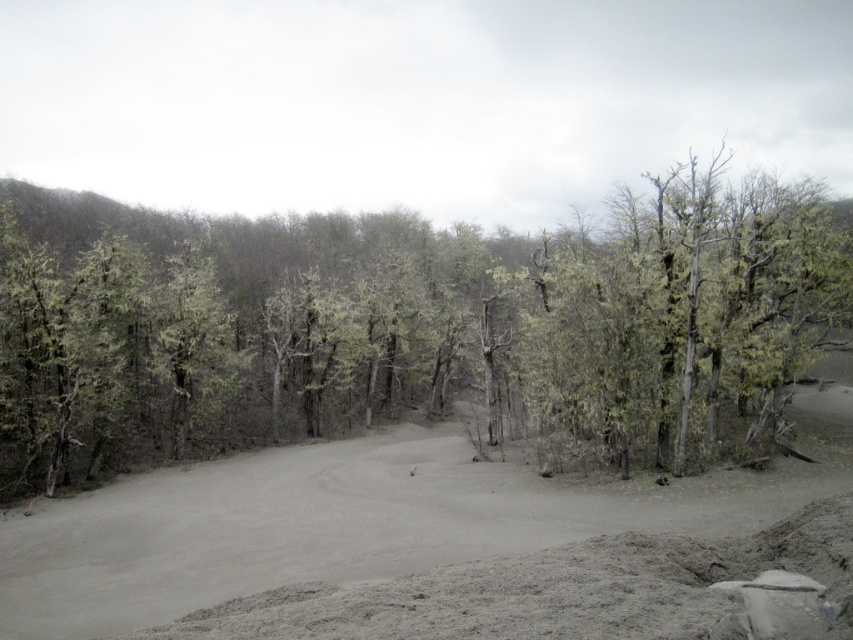
Is the position of green mossy tree at center less distant than that of gray sandy dirt track at center?

That is False.

Find the location of a particular element. This screenshot has width=853, height=640. green mossy tree at center is located at coordinates (410, 326).

Locate an element on the screen. green mossy tree at center is located at coordinates (410, 326).

Who is taller, gray sandy dirt track at center or gray sandy road at center?

With more height is gray sandy dirt track at center.

Is gray sandy dirt track at center further to camera compared to gray sandy road at center?

Yes.

Between point (198, 604) and point (563, 566), which one is positioned in front?

Point (563, 566) is more forward.

Identify the location of gray sandy dirt track at center. This screenshot has height=640, width=853. (357, 520).

Can you confirm if green mossy tree at center is wider than gray sandy road at center?

Yes.

Between green mossy tree at center and gray sandy road at center, which one is positioned lower?

gray sandy road at center is below.

What do you see at coordinates (410, 326) in the screenshot?
I see `green mossy tree at center` at bounding box center [410, 326].

You are a GUI agent. You are given a task and a screenshot of the screen. Output one action in this format:
    pyautogui.click(x=<x>, y=<y>)
    Task: Click on the green mossy tree at center
    The width and height of the screenshot is (853, 640).
    Given the screenshot: What is the action you would take?
    pyautogui.click(x=410, y=326)